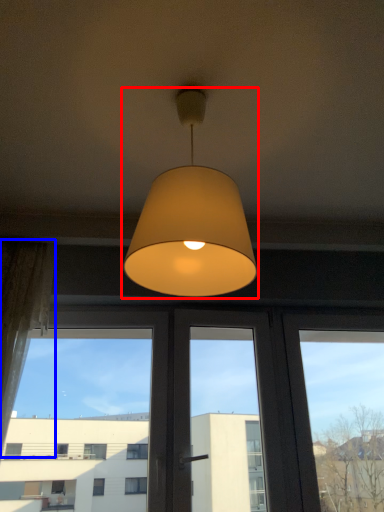
Question: Which object is closer to the camera taking this photo, lamp (highlighted by a red box) or curtain (highlighted by a blue box)?

Choices:
 (A) lamp
 (B) curtain

Answer: (A)